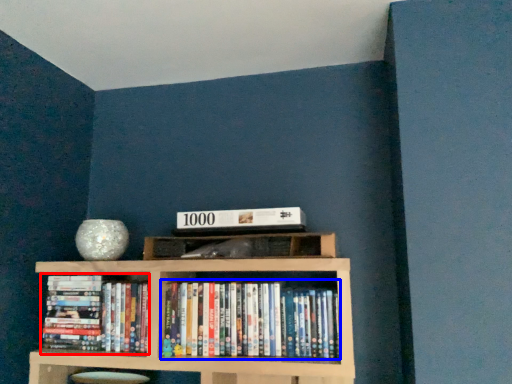
Question: Which point is further to the camera, book (highlighted by a red box) or book (highlighted by a blue box)?

Choices:
 (A) book
 (B) book

Answer: (A)